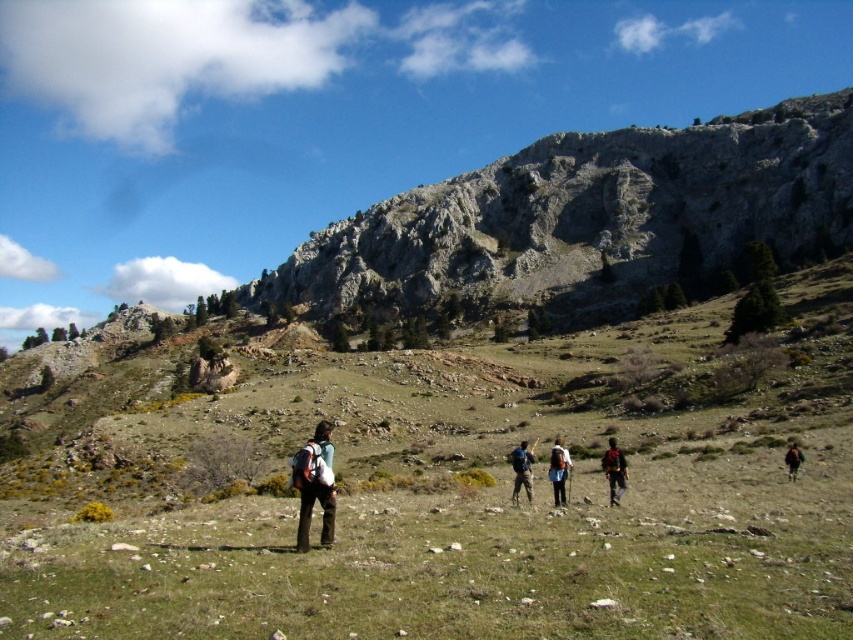
Question: Can you confirm if green grassy field at center is wider than dark red backpack at center?

Choices:
 (A) yes
 (B) no

Answer: (A)

Question: Which point is farther to the camera?

Choices:
 (A) dark red backpack at center
 (B) matte blue backpack at center
 (C) dark brown backpack at center

Answer: (C)

Question: Based on their relative distances, which object is farther from the green grassy field at center?

Choices:
 (A) matte blue backpack at center
 (B) dark blue backpack at center
 (C) dark brown backpack at center

Answer: (C)

Question: Is matte black backpack at center closer to the viewer compared to dark blue backpack at center?

Choices:
 (A) no
 (B) yes

Answer: (B)

Question: Which of the following is the closest to the observer?

Choices:
 (A) (498, 520)
 (B) (305, 520)
 (C) (555, 477)

Answer: (B)

Question: Can you confirm if matte black backpack at center is bigger than dark red backpack at center?

Choices:
 (A) yes
 (B) no

Answer: (A)